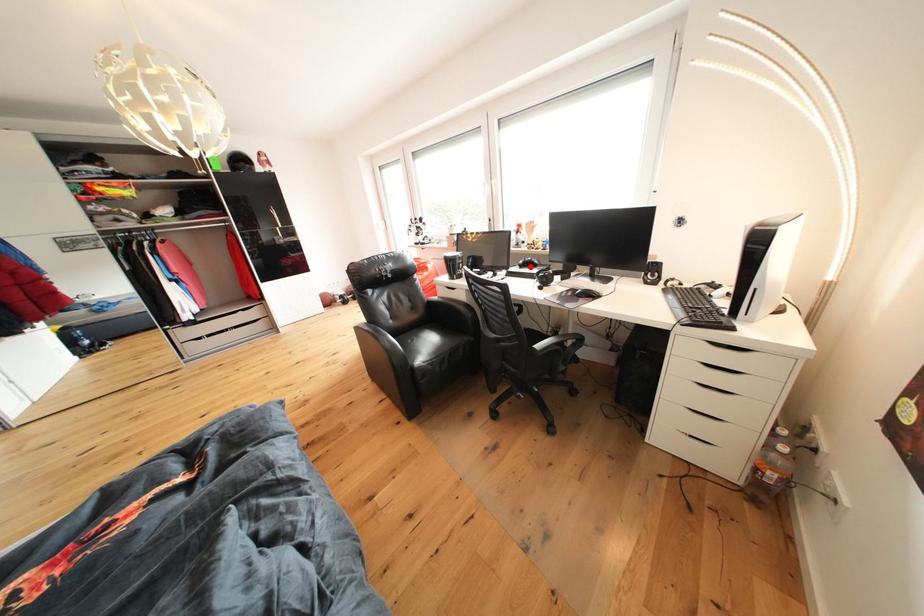
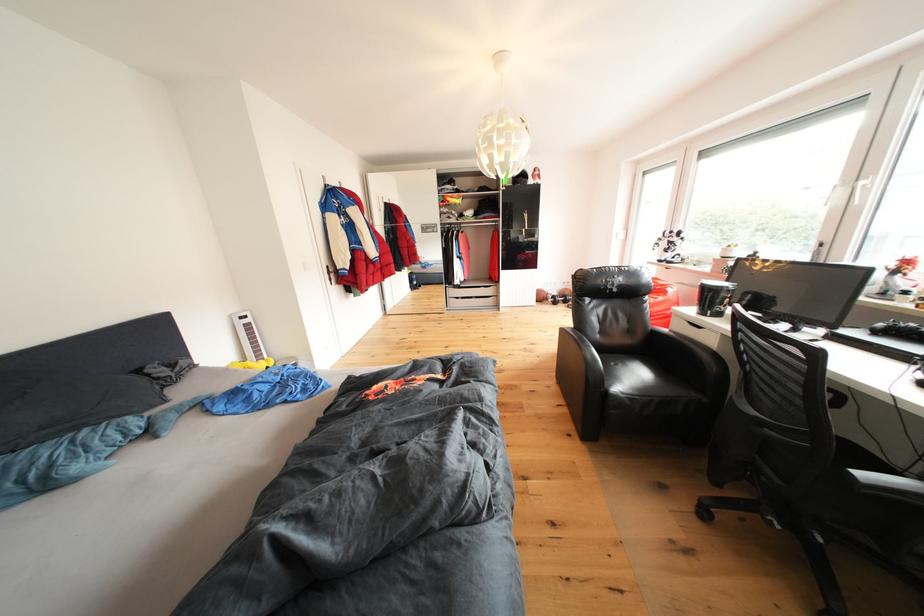
In the second image, find the point that corresponds to the highlighted location in the first image.

(890, 330)